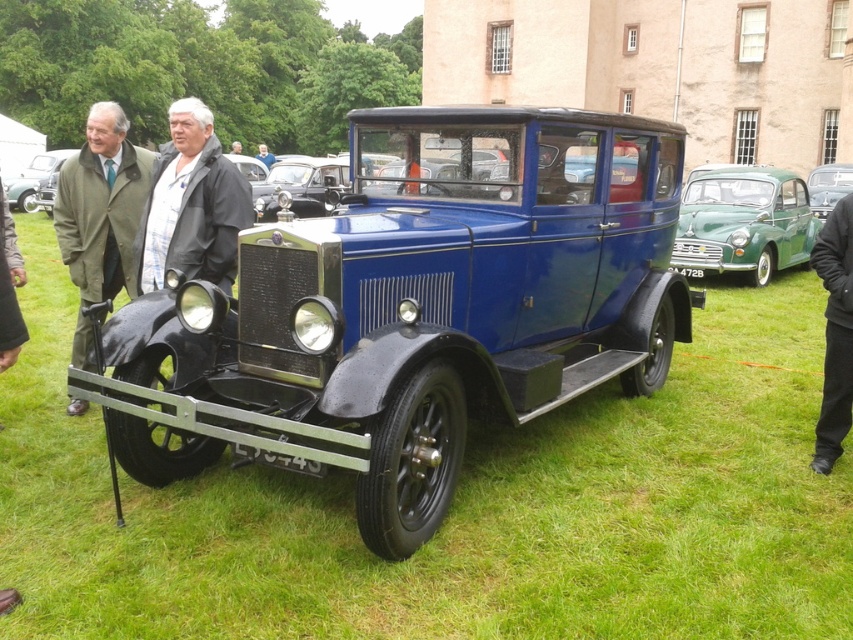
Based on the photo, who is positioned more to the right, blue metallic car at center or green matte car at right?

From the viewer's perspective, green matte car at right appears more on the right side.

Which is below, blue metallic car at center or green matte car at right?

blue metallic car at center is below.

Who is more distant from viewer, (x=398, y=387) or (x=759, y=182)?

Positioned behind is point (x=759, y=182).

Identify the location of blue metallic car at center. (415, 308).

Is green fabric coat at left thinner than metallic green car at center?

Incorrect, green fabric coat at left's width is not less than metallic green car at center's.

Is green fabric coat at left bigger than metallic green car at center?

Correct, green fabric coat at left is larger in size than metallic green car at center.

Image resolution: width=853 pixels, height=640 pixels. Identify the location of green fabric coat at left. 102,204.

The height and width of the screenshot is (640, 853). What do you see at coordinates (192, 204) in the screenshot?
I see `black fabric jacket at center` at bounding box center [192, 204].

Does black fabric jacket at center have a smaller size compared to green matte car at right?

Correct, black fabric jacket at center occupies less space than green matte car at right.

Which is in front, point (223, 236) or point (674, 252)?

Point (223, 236) is in front.

The height and width of the screenshot is (640, 853). What are the coordinates of `black fabric jacket at center` in the screenshot? It's located at (192, 204).